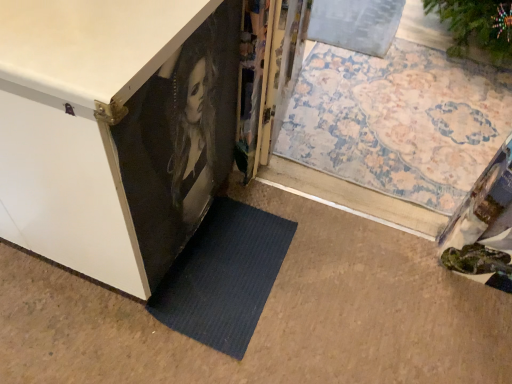
Identify the location of dark blue textured mat at lower left. (224, 276).

Describe the element at coordinates (224, 276) in the screenshot. I see `dark blue textured mat at lower left` at that location.

You are a GUI agent. You are given a task and a screenshot of the screen. Output one action in this format:
    pyautogui.click(x=<x>, y=<y>)
    Task: Click on the dark blue textured mat at lower left
    
    Given the screenshot: What is the action you would take?
    pyautogui.click(x=224, y=276)